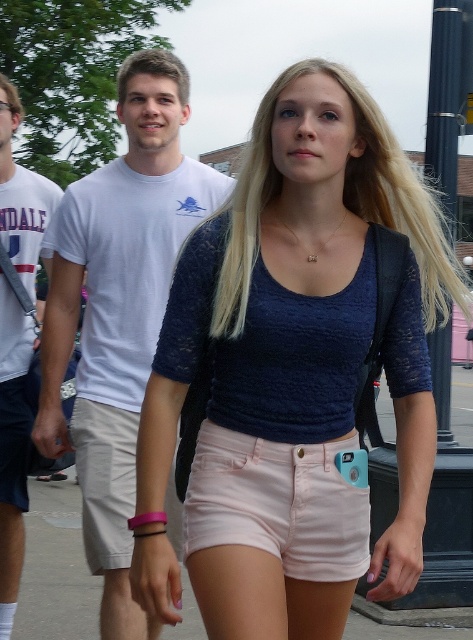
You are standing at the point marked by the coordinates point (x=294, y=372). Looking around, you see the blue lace top at center. What is the nearest object to your current position?

The nearest object to point (x=294, y=372) is the blue lace top at center, as the point marks its location.